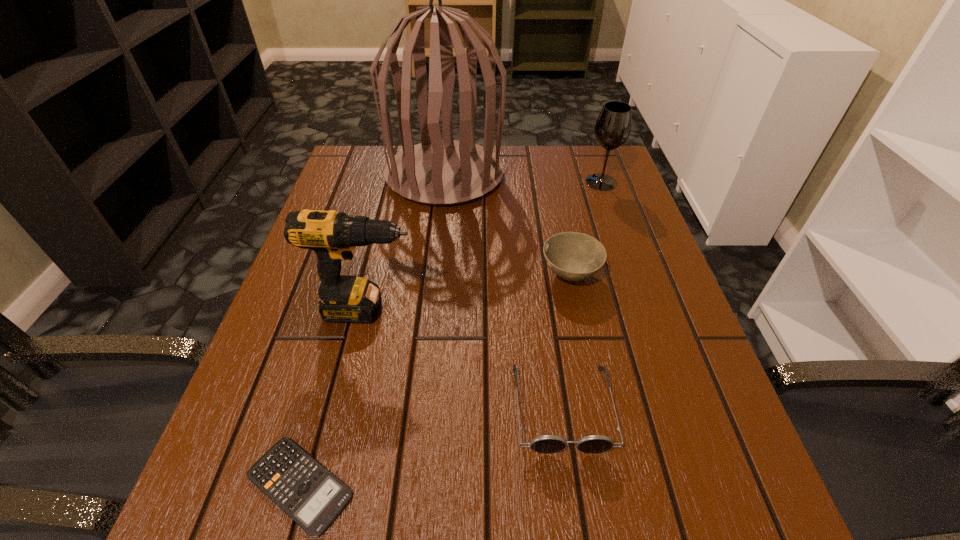
The width and height of the screenshot is (960, 540). Find the location of `vacant space located 0.050m on the front-facing side of the sunglasses`. vacant space located 0.050m on the front-facing side of the sunglasses is located at coordinates (574, 491).

The width and height of the screenshot is (960, 540). Find the location of `vacant space positioned 0.320m on the back of the calculator`. vacant space positioned 0.320m on the back of the calculator is located at coordinates (355, 286).

Where is `birdcage that is positioned at the far edge`? birdcage that is positioned at the far edge is located at coordinates (437, 172).

Identify the location of wineglass at the far edge. Image resolution: width=960 pixels, height=540 pixels. click(613, 127).

Find the location of a particular element. The width and height of the screenshot is (960, 540). object that is at the near edge is located at coordinates (306, 491).

The height and width of the screenshot is (540, 960). Identify the location of birdcage that is at the left edge. (437, 172).

Find the location of a particular element. This screenshot has height=540, width=960. drill that is at the left edge is located at coordinates (333, 236).

The image size is (960, 540). I want to click on calculator situated at the left edge, so click(x=306, y=491).

Find the location of a particular element. This screenshot has height=540, width=960. wineglass present at the right edge is located at coordinates (613, 127).

What are the coordinates of `bowl that is positioned at the right edge` in the screenshot? It's located at (573, 256).